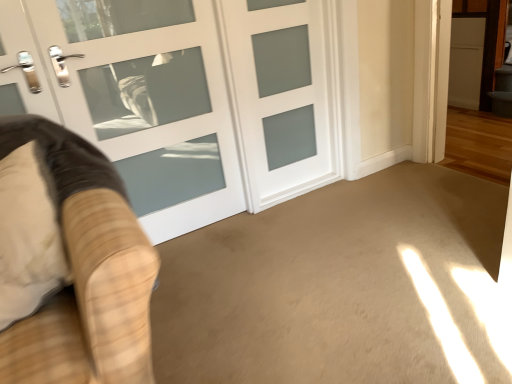
Where is `velvet beige armchair at left`? This screenshot has width=512, height=384. velvet beige armchair at left is located at coordinates (98, 247).

This screenshot has height=384, width=512. I want to click on white frosted glass door at center, positioned as the 1th door in left-to-right order, so click(189, 97).

Is white frosted glass door at center, positioned as the 2th door in right-to-left order, turned away from white frosted glass door at center, the second door from the left?

Yes.

Is white frosted glass door at center, positioned as the 2th door in right-to-left order, thinner than white frosted glass door at center, the second door from the left?

In fact, white frosted glass door at center, positioned as the 2th door in right-to-left order, might be wider than white frosted glass door at center, the second door from the left.

Identify the location of door behind the white frosted glass door at center, positioned as the 1th door in left-to-right order. (281, 96).

Does white frosted glass door at center, positioned as the 2th door in right-to-left order, have a greater height compared to white frosted glass door at center, which is the 1th door in right-to-left order?

Correct, white frosted glass door at center, positioned as the 2th door in right-to-left order, is much taller as white frosted glass door at center, which is the 1th door in right-to-left order.

Which object is thinner, beige carpet at center or velvet beige armchair at left?

With smaller width is velvet beige armchair at left.

From the image's perspective, would you say beige carpet at center is positioned over velvet beige armchair at left?

No, from the image's perspective, beige carpet at center is not over velvet beige armchair at left.

From a real-world perspective, relative to velvet beige armchair at left, is beige carpet at center vertically above or below?

From a real-world perspective, beige carpet at center is physically below velvet beige armchair at left.

From the picture: Could you tell me if beige carpet at center is turned towards velvet beige armchair at left?

No, beige carpet at center is not turned towards velvet beige armchair at left.

Looking at their sizes, would you say beige carpet at center is wider or thinner than white frosted glass door at center, positioned as the 1th door in left-to-right order?

beige carpet at center is wider than white frosted glass door at center, positioned as the 1th door in left-to-right order.

Which object is further away from the camera, beige carpet at center or white frosted glass door at center, positioned as the 2th door in right-to-left order?

white frosted glass door at center, positioned as the 2th door in right-to-left order.

Is beige carpet at center taller than white frosted glass door at center, positioned as the 2th door in right-to-left order?

In fact, beige carpet at center may be shorter than white frosted glass door at center, positioned as the 2th door in right-to-left order.

Would you say beige carpet at center is inside or outside white frosted glass door at center, positioned as the 1th door in left-to-right order?

beige carpet at center exists outside the volume of white frosted glass door at center, positioned as the 1th door in left-to-right order.

Which door is the 1st one when counting from the back of the velvet beige armchair at left? Please provide its 2D coordinates.

[(189, 97)]

Would you say velvet beige armchair at left is a long distance from white frosted glass door at center, positioned as the 2th door in right-to-left order?

No, velvet beige armchair at left is in close proximity to white frosted glass door at center, positioned as the 2th door in right-to-left order.

Considering the relative sizes of velvet beige armchair at left and white frosted glass door at center, positioned as the 2th door in right-to-left order, in the image provided, is velvet beige armchair at left shorter than white frosted glass door at center, positioned as the 2th door in right-to-left order,?

Indeed, velvet beige armchair at left has a lesser height compared to white frosted glass door at center, positioned as the 2th door in right-to-left order.

In the scene shown: From a real-world perspective, is velvet beige armchair at left physically located above or below white frosted glass door at center, positioned as the 1th door in left-to-right order?

Clearly, from a real-world perspective, velvet beige armchair at left is below white frosted glass door at center, positioned as the 1th door in left-to-right order.

Is velvet beige armchair at left facing towards beige carpet at center?

No, velvet beige armchair at left is not aimed at beige carpet at center.

Who is smaller, velvet beige armchair at left or beige carpet at center?

With smaller size is beige carpet at center.

Between point (106, 343) and point (348, 230), which one is positioned behind?

The point (348, 230) is farther.

From a real-world perspective, is velvet beige armchair at left physically located above or below beige carpet at center?

velvet beige armchair at left is situated higher than beige carpet at center in the real world.

From a real-world perspective, is white frosted glass door at center, the second door from the left, physically below velvet beige armchair at left?

Yes, from a real-world perspective, white frosted glass door at center, the second door from the left, is under velvet beige armchair at left.

Identify the location of furniture that appears on the left of white frosted glass door at center, the second door from the left. This screenshot has width=512, height=384. (98, 247).

Which object is positioned more to the left, white frosted glass door at center, which is the 1th door in right-to-left order, or velvet beige armchair at left?

Positioned to the left is velvet beige armchair at left.

Who is bigger, white frosted glass door at center, which is the 1th door in right-to-left order, or velvet beige armchair at left?

Bigger between the two is velvet beige armchair at left.

How many degrees apart are the facing directions of white frosted glass door at center, the second door from the left, and beige carpet at center?

The angular difference between white frosted glass door at center, the second door from the left, and beige carpet at center is 0.111 degrees.

Which is behind, white frosted glass door at center, the second door from the left, or beige carpet at center?

white frosted glass door at center, the second door from the left, is further from the camera.

From the image's perspective, which is below, white frosted glass door at center, the second door from the left, or beige carpet at center?

beige carpet at center, from the image's perspective.

From a real-world perspective, is white frosted glass door at center, the second door from the left, over beige carpet at center?

Correct, in the physical world, white frosted glass door at center, the second door from the left, is higher than beige carpet at center.

Where is `door that appears below the white frosted glass door at center, positioned as the 1th door in left-to-right order (from a real-world perspective)`? door that appears below the white frosted glass door at center, positioned as the 1th door in left-to-right order (from a real-world perspective) is located at coordinates (281, 96).

At what (x,y) coordinates should I click in order to perform the action: click on corridor that is in front of the velvet beige armchair at left. Please return your answer as a coordinate pair (x, y). The image size is (512, 384). Looking at the image, I should click on (340, 287).

Looking at the image, which one is located closer to velvet beige armchair at left, beige carpet at center or white frosted glass door at center, positioned as the 1th door in left-to-right order?

Based on the image, beige carpet at center appears to be nearer to velvet beige armchair at left.

Considering their positions, is beige carpet at center positioned closer to white frosted glass door at center, positioned as the 2th door in right-to-left order, than white frosted glass door at center, which is the 1th door in right-to-left order?

The object closer to white frosted glass door at center, positioned as the 2th door in right-to-left order, is white frosted glass door at center, which is the 1th door in right-to-left order.

Looking at the image, which one is located further to velvet beige armchair at left, white frosted glass door at center, positioned as the 1th door in left-to-right order, or beige carpet at center?

Among the two, white frosted glass door at center, positioned as the 1th door in left-to-right order, is located further to velvet beige armchair at left.

Estimate the real-world distances between objects in this image. Which object is closer to white frosted glass door at center, positioned as the 1th door in left-to-right order, velvet beige armchair at left or white frosted glass door at center, the second door from the left?

white frosted glass door at center, the second door from the left, is closer to white frosted glass door at center, positioned as the 1th door in left-to-right order.

From the image, which object appears to be farther from beige carpet at center, white frosted glass door at center, positioned as the 1th door in left-to-right order, or velvet beige armchair at left?

Based on the image, velvet beige armchair at left appears to be further to beige carpet at center.

From the image, which object appears to be farther from white frosted glass door at center, positioned as the 2th door in right-to-left order, velvet beige armchair at left or beige carpet at center?

velvet beige armchair at left lies further to white frosted glass door at center, positioned as the 2th door in right-to-left order, than the other object.

When comparing their distances from white frosted glass door at center, the second door from the left, does beige carpet at center or white frosted glass door at center, positioned as the 2th door in right-to-left order, seem further?

Among the two, beige carpet at center is located further to white frosted glass door at center, the second door from the left.

Which object lies further to the anchor point velvet beige armchair at left, white frosted glass door at center, positioned as the 1th door in left-to-right order, or white frosted glass door at center, which is the 1th door in right-to-left order?

white frosted glass door at center, which is the 1th door in right-to-left order, is positioned further to the anchor velvet beige armchair at left.

Locate an element on the screen. The image size is (512, 384). door between velvet beige armchair at left and white frosted glass door at center, which is the 1th door in right-to-left order, along the z-axis is located at coordinates (189, 97).

This screenshot has height=384, width=512. Find the location of `door located between beige carpet at center and white frosted glass door at center, the second door from the left, in the depth direction`. door located between beige carpet at center and white frosted glass door at center, the second door from the left, in the depth direction is located at coordinates (189, 97).